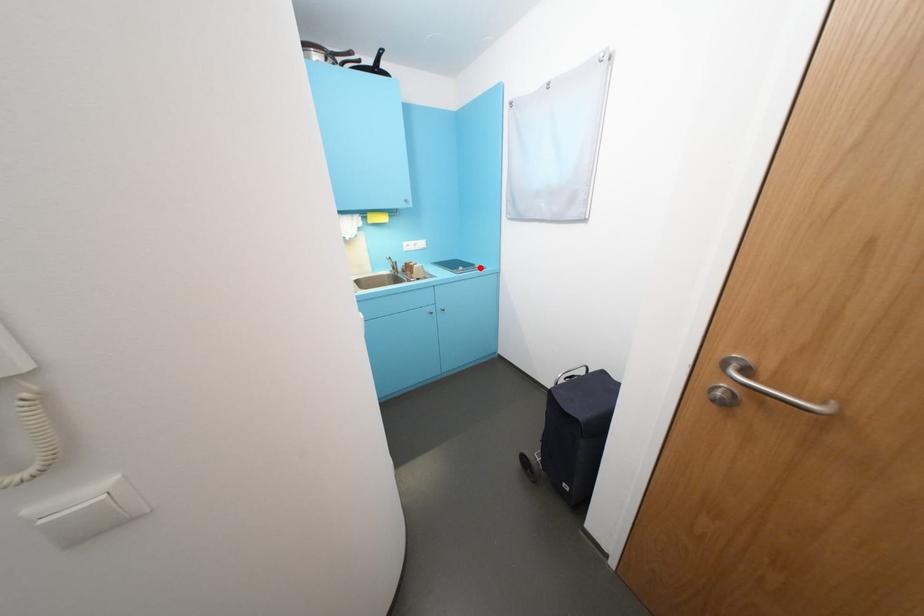
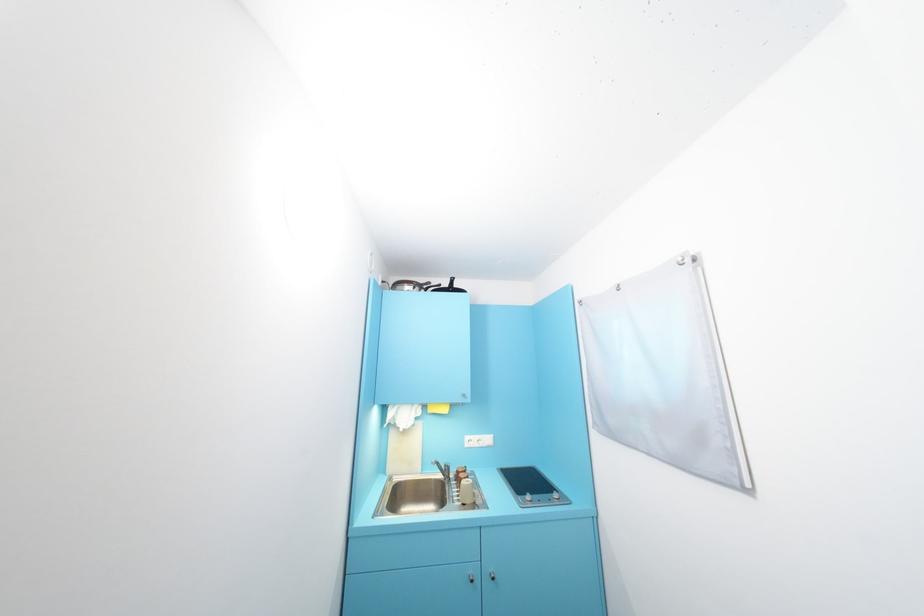
Question: I am providing you with two images of the same scene from different viewpoints. A red point is shown in image1. For the corresponding object point in image2, is it positioned nearer or farther from the camera?

Choices:
 (A) Nearer
 (B) Farther

Answer: (B)